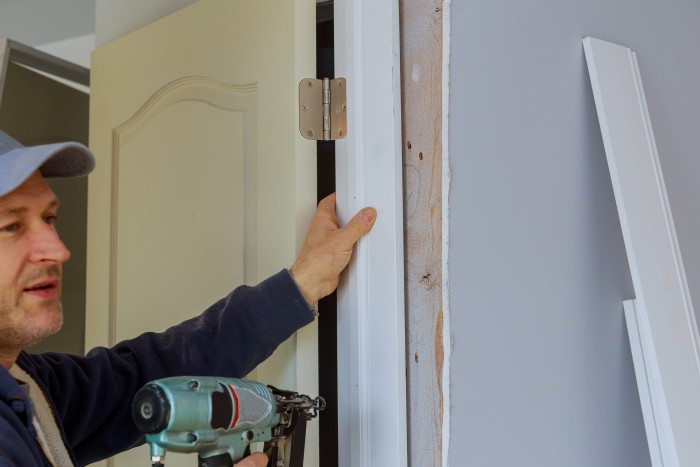
Find the location of `exposed wood`. exposed wood is located at coordinates (420, 159).